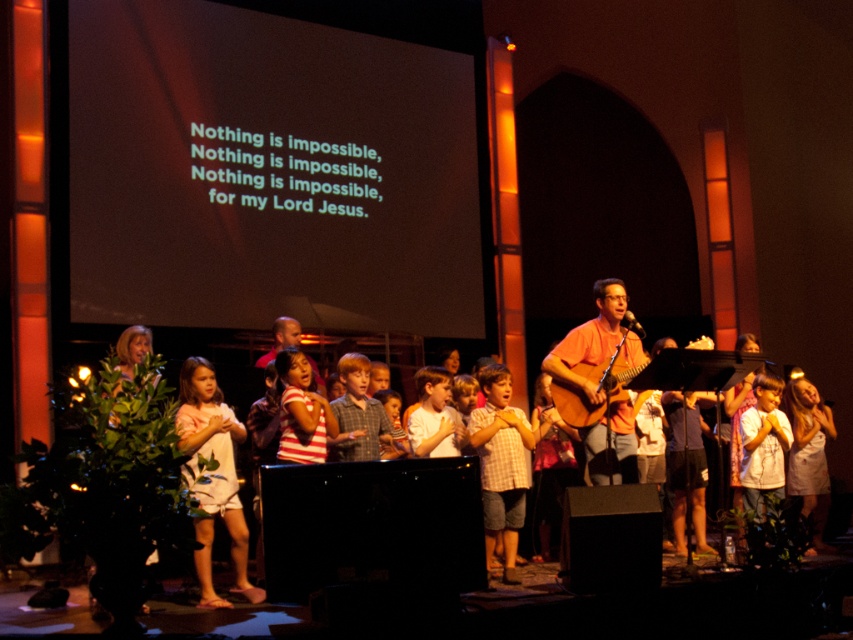
Question: Is checkered fabric shirt at center to the left of orange matte guitar at center from the viewer's perspective?

Choices:
 (A) no
 (B) yes

Answer: (B)

Question: Based on their relative distances, which object is farther from the smooth brown shirt at center?

Choices:
 (A) pink cotton dress at center
 (B) orange matte guitar at center

Answer: (B)

Question: From the image, what is the correct spatial relationship of checkered fabric shirt at center in relation to smooth brown shirt at center?

Choices:
 (A) below
 (B) above

Answer: (A)

Question: Can you confirm if checkered fabric shirt at center is thinner than orange matte guitar at center?

Choices:
 (A) no
 (B) yes

Answer: (B)

Question: Which is nearer to the orange matte guitar at center?

Choices:
 (A) checkered fabric shirt at center
 (B) pink cotton dress at center

Answer: (A)

Question: Which point appears farthest from the camera in this image?

Choices:
 (A) (520, 465)
 (B) (296, 326)
 (C) (619, 406)
 (D) (192, 364)

Answer: (B)